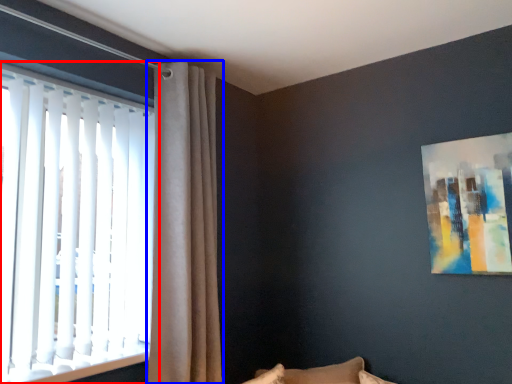
Question: Which object appears closest to the camera in this image, window (highlighted by a red box) or curtain (highlighted by a blue box)?

Choices:
 (A) window
 (B) curtain

Answer: (A)